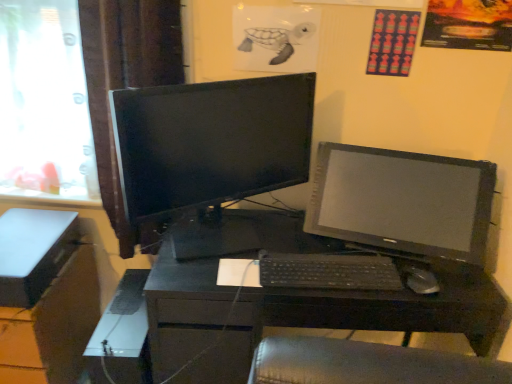
In order to click on free space above black plastic keyboard at center (from a real-world perspective) in this screenshot , I will do `click(322, 263)`.